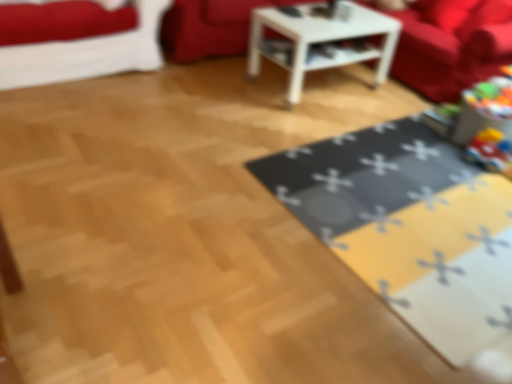
Where is `free space in front of velvet red couch at upper center, which ranks as the 1th couch in left-to-right order`? Image resolution: width=512 pixels, height=384 pixels. free space in front of velvet red couch at upper center, which ranks as the 1th couch in left-to-right order is located at coordinates (215, 98).